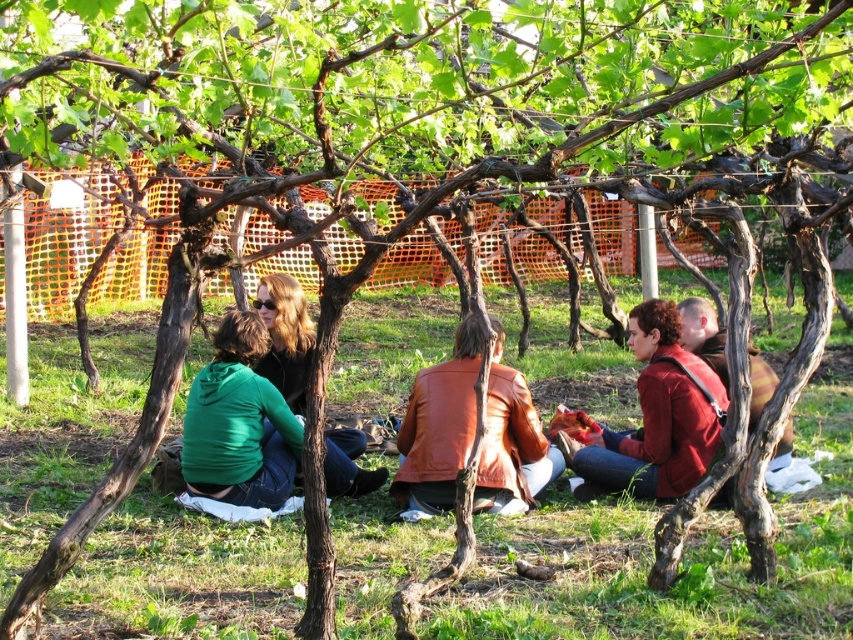
Question: Among these points, which one is nearest to the camera?

Choices:
 (A) (486, 506)
 (B) (267, 461)

Answer: (A)

Question: Considering the real-world distances, which object is closest to the brown leather jacket at center?

Choices:
 (A) green matte jacket at lower left
 (B) matte red jacket at center
 (C) matte brown leather jacket at center

Answer: (B)

Question: Does matte red jacket at center have a greater width compared to matte brown leather jacket at center?

Choices:
 (A) no
 (B) yes

Answer: (B)

Question: From the image, what is the correct spatial relationship of brown leather jacket at center in relation to matte red jacket at center?

Choices:
 (A) right
 (B) left

Answer: (B)

Question: Which of the following is the closest to the observer?

Choices:
 (A) (447, 435)
 (B) (666, 348)
 (C) (712, 353)
 (D) (234, 429)

Answer: (A)

Question: Does green matte jacket at lower left have a lesser width compared to matte brown leather jacket at center?

Choices:
 (A) yes
 (B) no

Answer: (B)